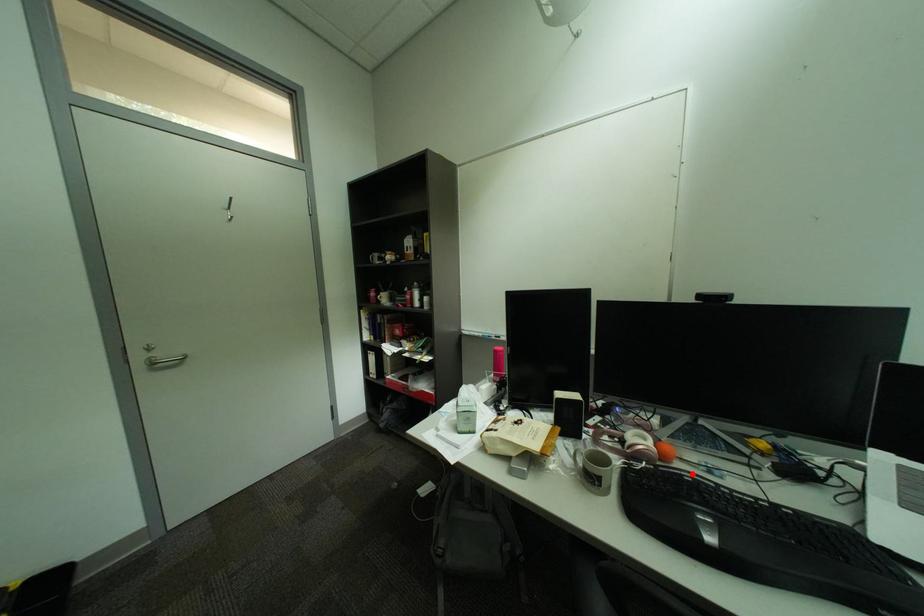
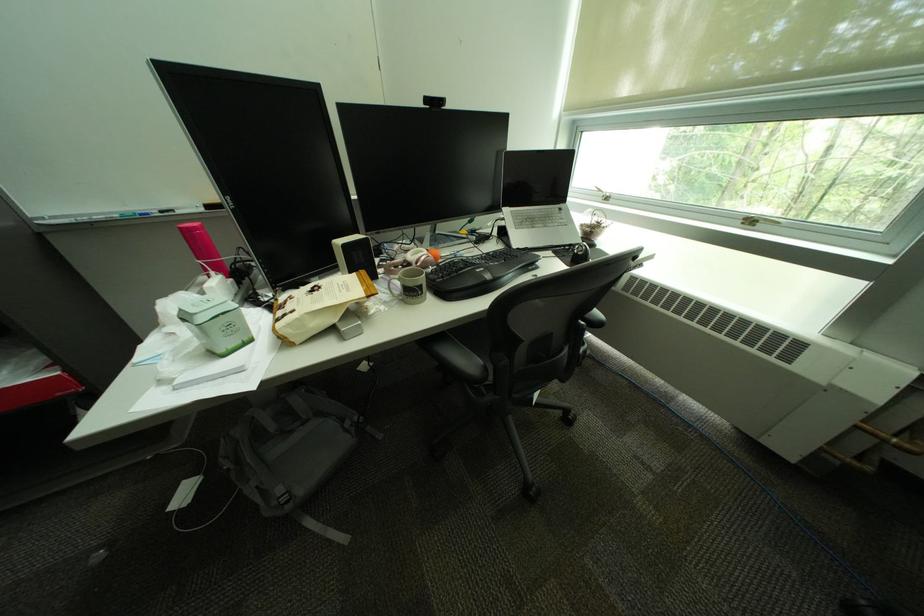
In the second image, find the point that corresponds to the highlighted location in the first image.

(463, 261)